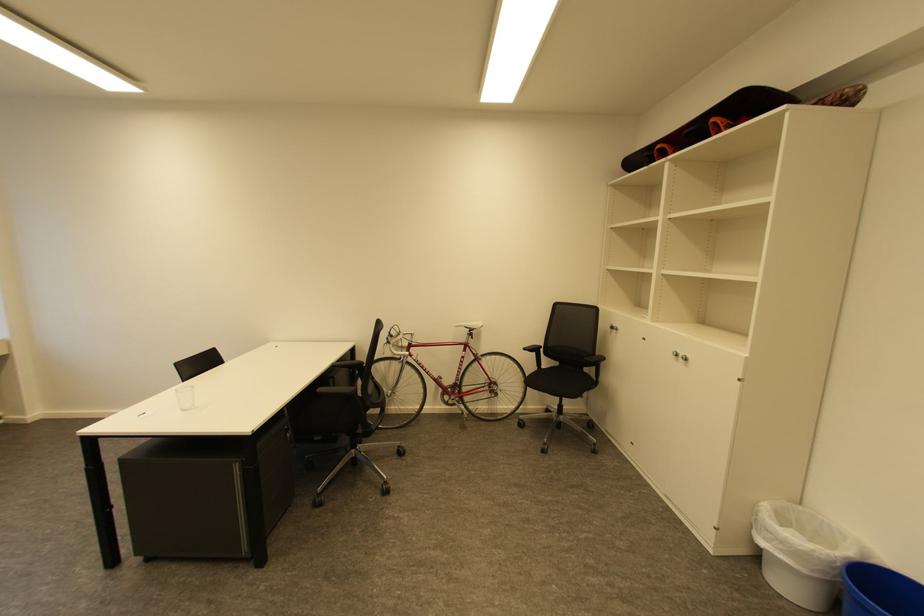
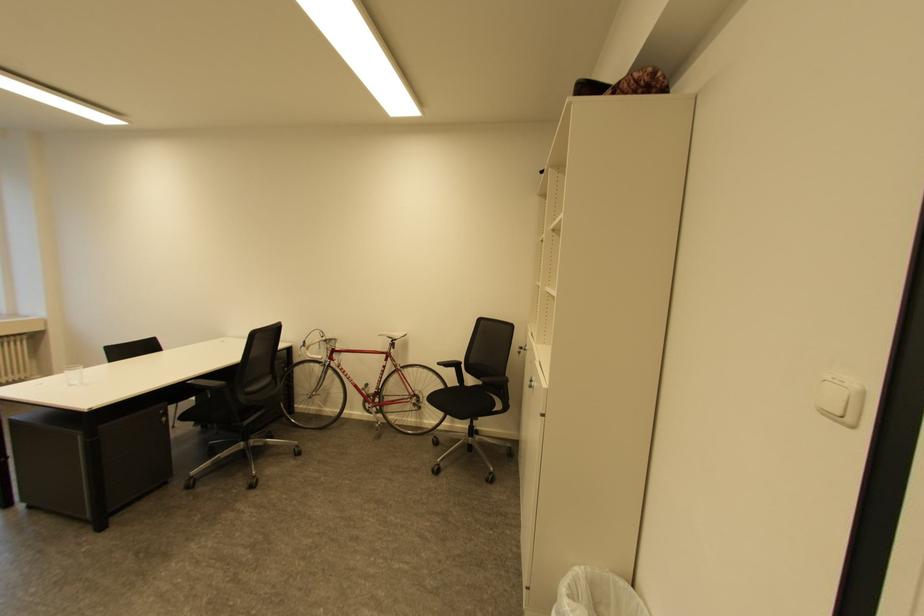
Where in the second image is the point corresponding to (394,339) from the first image?

(311, 342)